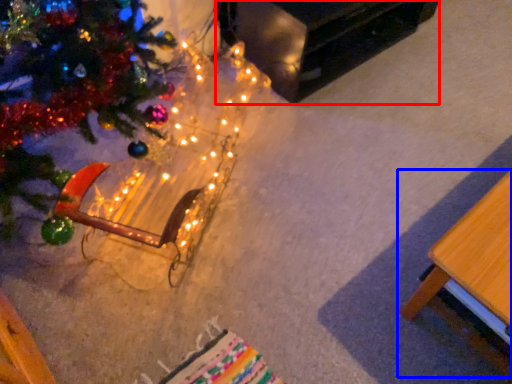
Question: Which point is further to the camera, table (highlighted by a red box) or table (highlighted by a blue box)?

Choices:
 (A) table
 (B) table

Answer: (A)